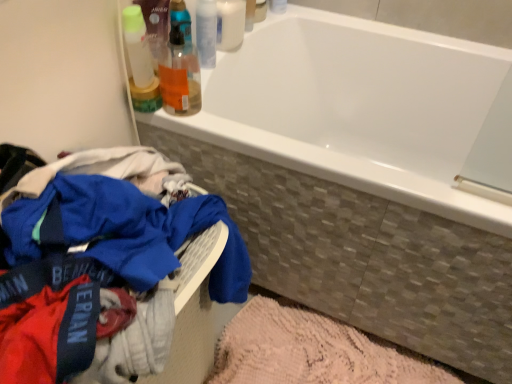
Question: Is blue cotton clothes at lower left at the back of white glossy bottle at upper center, the second toiletry viewed from the top?

Choices:
 (A) no
 (B) yes

Answer: (A)

Question: From the image's perspective, would you say white glossy bottle at upper center, the second toiletry viewed from the top, is positioned over blue cotton clothes at lower left?

Choices:
 (A) yes
 (B) no

Answer: (A)

Question: Is white glossy bottle at upper center, placed as the 2th toiletry when sorted from bottom to top, positioned before blue cotton clothes at lower left?

Choices:
 (A) no
 (B) yes

Answer: (A)

Question: Can you confirm if white glossy bottle at upper center, placed as the 2th toiletry when sorted from bottom to top, is positioned to the left of blue cotton clothes at lower left?

Choices:
 (A) yes
 (B) no

Answer: (B)

Question: Is white glossy bottle at upper center, the second toiletry viewed from the top, with blue cotton clothes at lower left?

Choices:
 (A) yes
 (B) no

Answer: (B)

Question: From the image's perspective, relative to pink textured bath mat at lower center, is white glossy bottle at upper center, the second toiletry viewed from the top, above or below?

Choices:
 (A) above
 (B) below

Answer: (A)

Question: Considering the positions of white glossy bottle at upper center, the second toiletry viewed from the top, and pink textured bath mat at lower center in the image, is white glossy bottle at upper center, the second toiletry viewed from the top, taller or shorter than pink textured bath mat at lower center?

Choices:
 (A) tall
 (B) short

Answer: (A)

Question: Looking at the image, does white glossy bottle at upper center, the second toiletry viewed from the top, seem bigger or smaller compared to pink textured bath mat at lower center?

Choices:
 (A) small
 (B) big

Answer: (A)

Question: Is white glossy bottle at upper center, the second toiletry viewed from the top, in front of or behind pink textured bath mat at lower center in the image?

Choices:
 (A) front
 (B) behind

Answer: (A)

Question: In the image, is white glossy bottle at upper center, placed as the 2th toiletry when sorted from bottom to top, positioned in front of or behind white glossy bathtub at upper center?

Choices:
 (A) behind
 (B) front

Answer: (A)

Question: Visually, is white glossy bottle at upper center, the second toiletry viewed from the top, positioned to the left or to the right of white glossy bathtub at upper center?

Choices:
 (A) right
 (B) left

Answer: (B)

Question: Which is correct: white glossy bottle at upper center, placed as the 2th toiletry when sorted from bottom to top, is inside white glossy bathtub at upper center, or outside of it?

Choices:
 (A) outside
 (B) inside

Answer: (A)

Question: From the image's perspective, is white glossy bottle at upper center, the second toiletry viewed from the top, above or below white glossy bathtub at upper center?

Choices:
 (A) above
 (B) below

Answer: (A)

Question: Considering the relative positions of white glossy bottle at upper center, placed as the 1th toiletry when sorted from top to bottom, and white glossy bathtub at upper center in the image provided, is white glossy bottle at upper center, placed as the 1th toiletry when sorted from top to bottom, to the left or to the right of white glossy bathtub at upper center?

Choices:
 (A) right
 (B) left

Answer: (B)

Question: From the image's perspective, is white glossy bottle at upper center, placed as the 1th toiletry when sorted from top to bottom, above or below white glossy bathtub at upper center?

Choices:
 (A) below
 (B) above

Answer: (B)